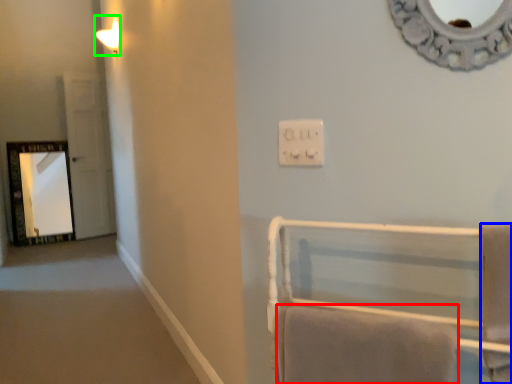
Question: Based on their relative distances, which object is farther from bath towel (highlighted by a red box)? Choose from bath towel (highlighted by a blue box) and light fixture (highlighted by a green box).

Choices:
 (A) bath towel
 (B) light fixture

Answer: (B)